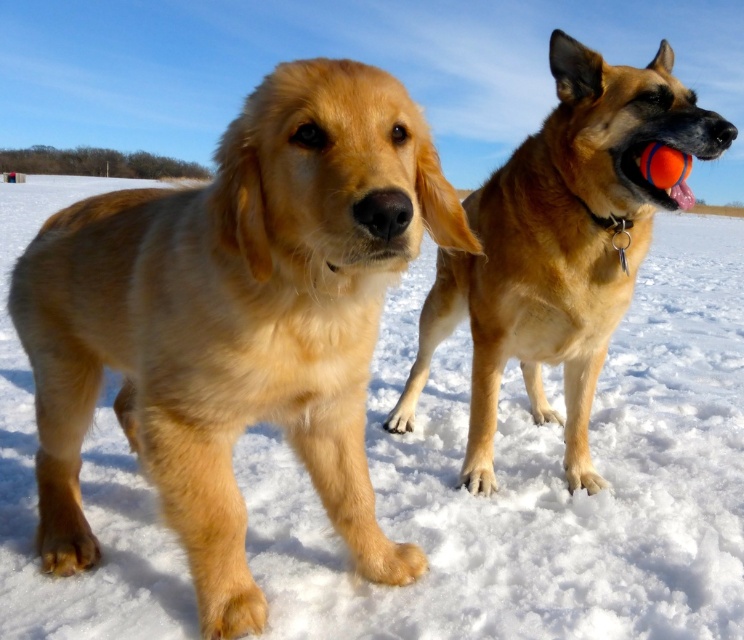
You are a photographer trying to capture both the golden fur dog at center and the golden fur dog at right in a single shot. Given that your camera can only focus on objects within a 1.5 meter range, will both dogs fit in the frame if they are positioned side by side?

The golden fur dog at center is smaller in size compared to the golden fur dog at right. However, since the camera can focus on objects within a 1.5 meter range, both dogs can fit in the frame as long as their combined width does not exceed the camera range. The exact distance between them would determine if they fit, but the size difference alone does not prevent it.

In the scene shown: Please provide the 2D coordinates of the golden fur dog at center in the image. The coordinates should be in the format of a tuple with two decimal numbers separated by a comma, enclosed in parentheses. For example, if the coordinates were at the center of the image, you would write something like this format. The answer must be concise and only include the coordinates without any additional text or explanation.

The 2D coordinates of the golden fur dog at center are at point (237, 321).

You are a photographer trying to capture both dogs in a single frame. Given that your camera can only fit objects within a 1.5 meter width, will both the golden fur dog at center and the golden fur dog at right fit side by side without overlapping?

The golden fur dog at center is wider than the golden fur dog at right. However, since the exact widths are not provided, it is uncertain if their combined width exceeds 1.5 meters. Additional information is needed to determine if they can fit side by side without overlapping.